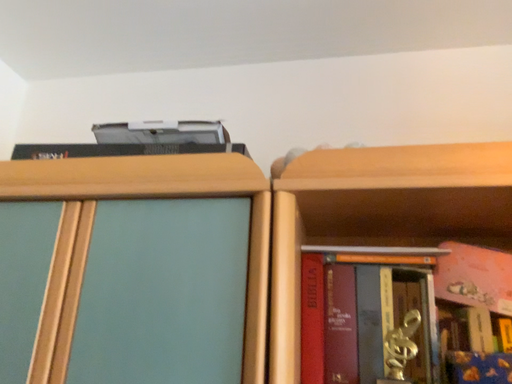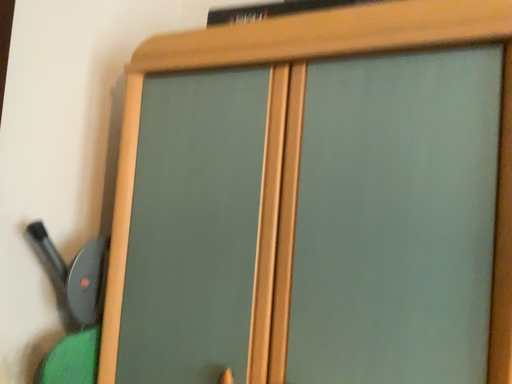
Question: How did the camera likely rotate when shooting the video?

Choices:
 (A) rotated downward
 (B) rotated upward

Answer: (A)